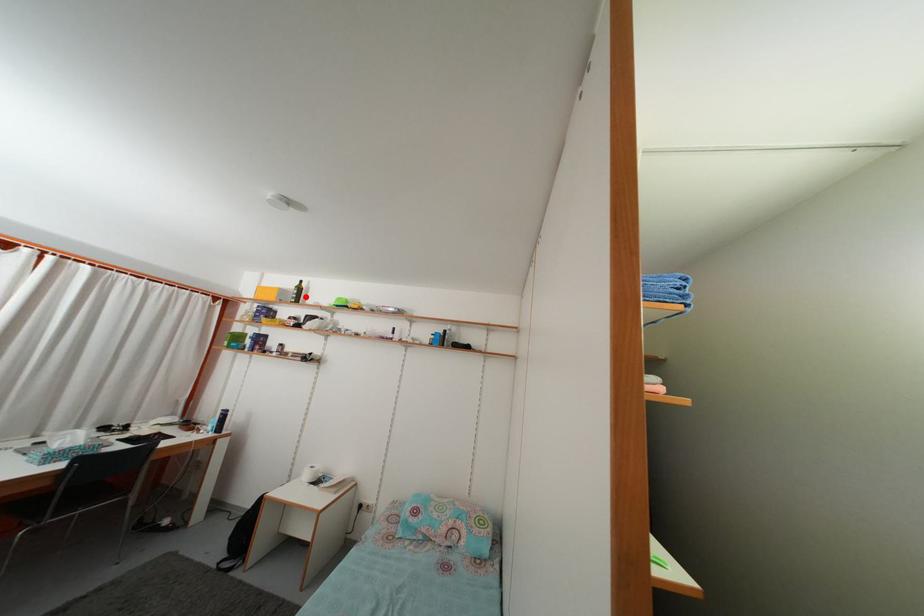
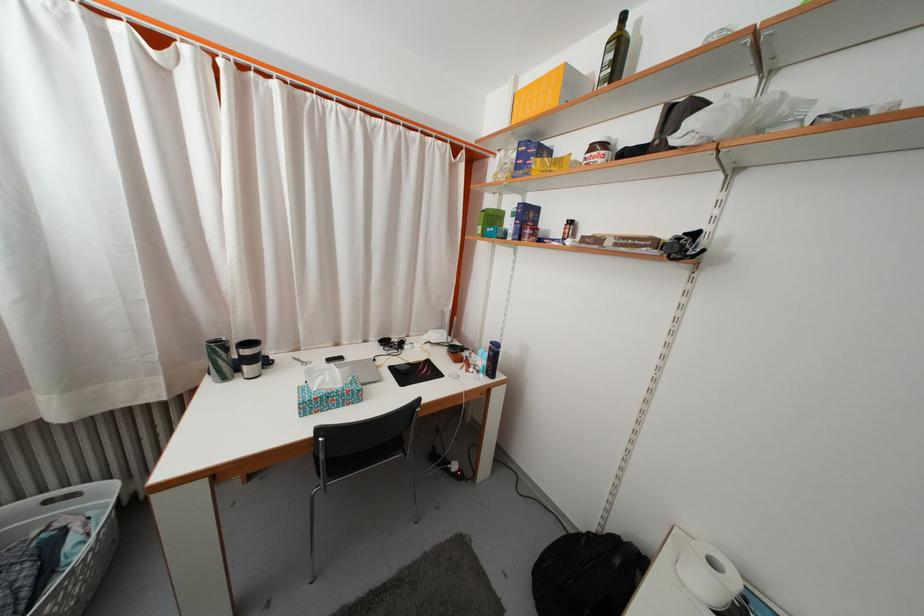
Where in the second image is the point corresponding to the highlighted location from the first image?

(625, 54)